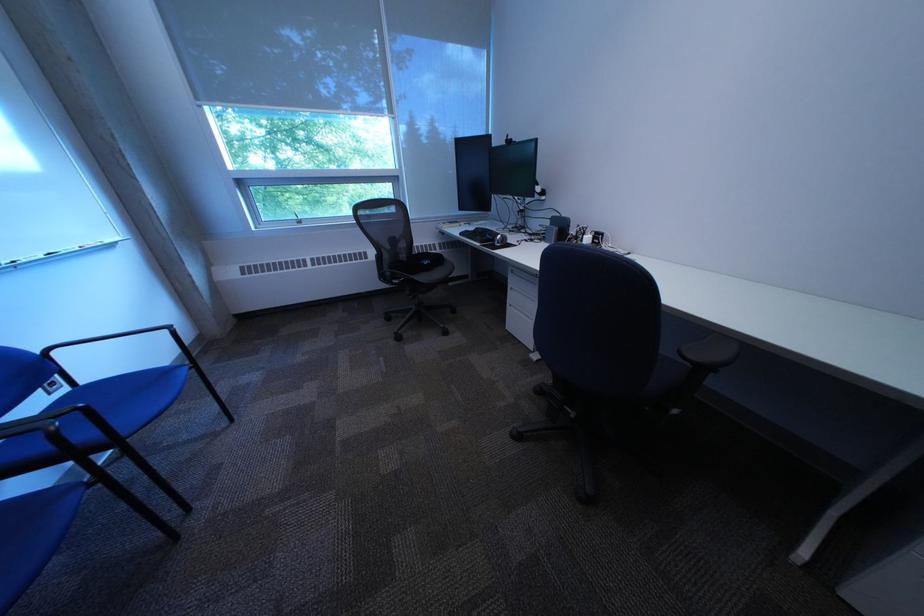
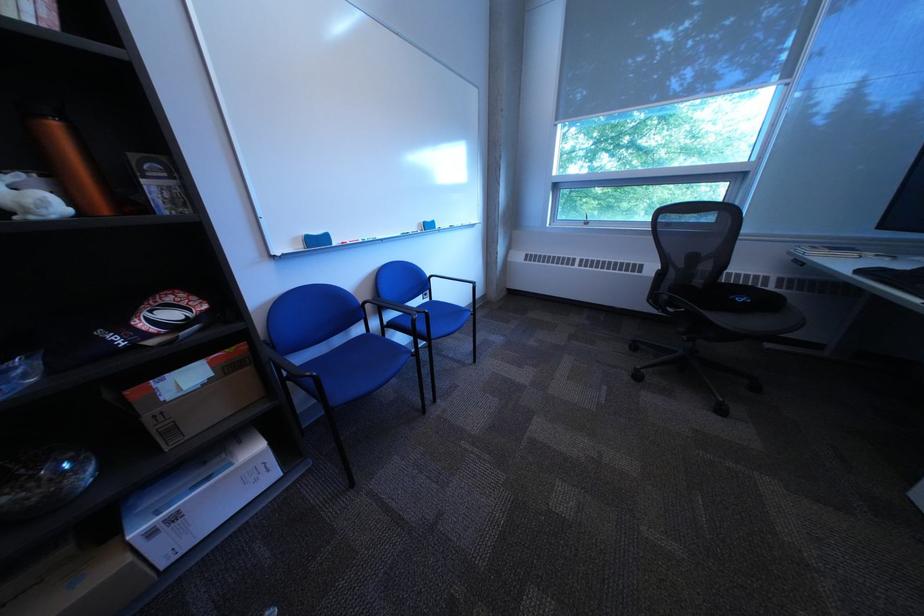
Question: The first image is from the beginning of the video and the second image is from the end. How did the camera likely rotate when shooting the video?

Choices:
 (A) Left
 (B) Right
 (C) Up
 (D) Down

Answer: (A)